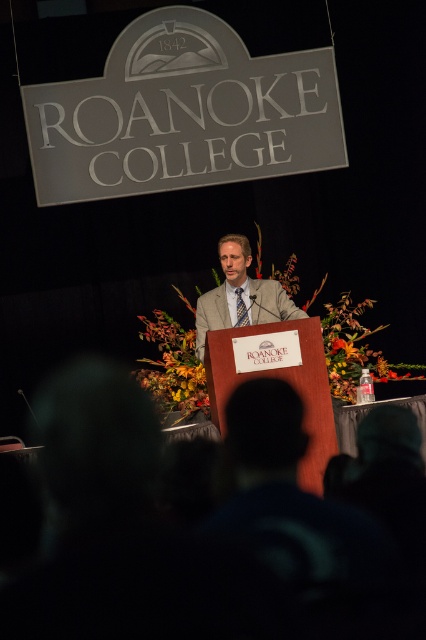
Does point (259, 284) come farther from viewer compared to point (244, 310)?

Yes, point (259, 284) is behind point (244, 310).

Is light brown suit at center to the right of blue checkered tie at center from the viewer's perspective?

Yes, light brown suit at center is to the right of blue checkered tie at center.

Which is behind, point (273, 294) or point (247, 317)?

Positioned behind is point (273, 294).

This screenshot has height=640, width=426. Identify the location of light brown suit at center. (241, 294).